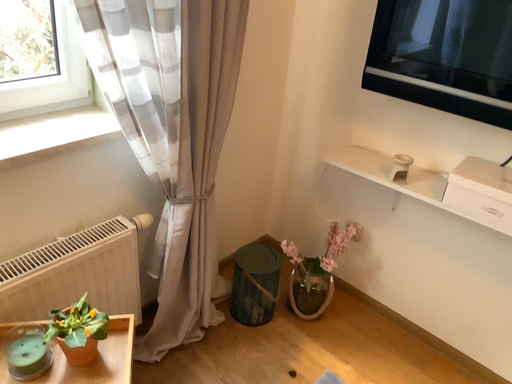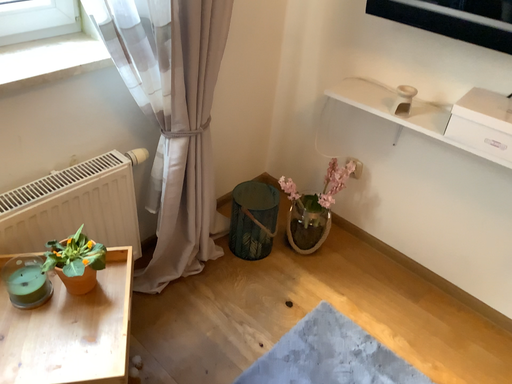
Question: How did the camera likely rotate when shooting the video?

Choices:
 (A) rotated upward
 (B) rotated downward

Answer: (B)